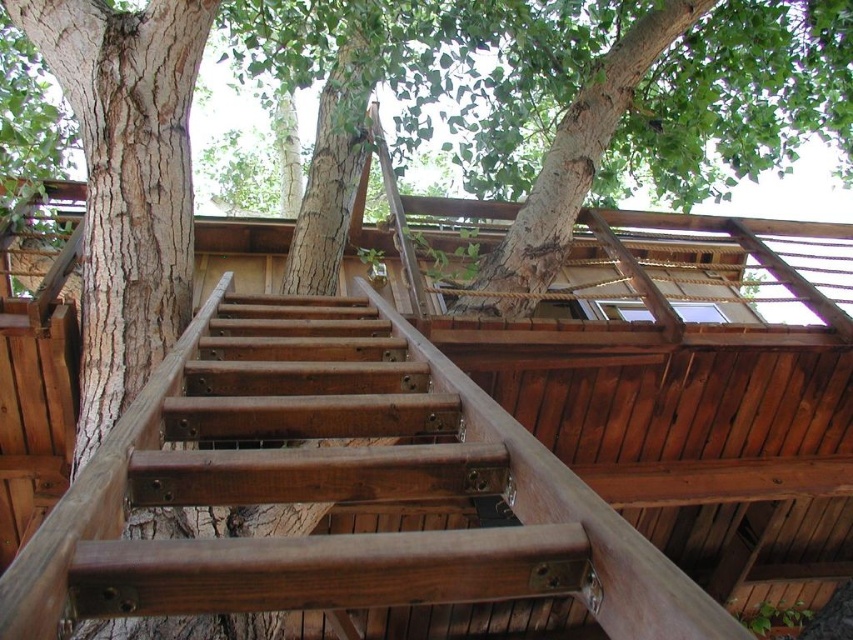
Who is positioned more to the right, brown wooden stairs at center or wooden ladder at center?

From the viewer's perspective, wooden ladder at center appears more on the right side.

Image resolution: width=853 pixels, height=640 pixels. In order to click on brown wooden stairs at center in this screenshot , I will do `click(316, 417)`.

Find the location of `brown wooden stairs at center`. brown wooden stairs at center is located at coordinates (316, 417).